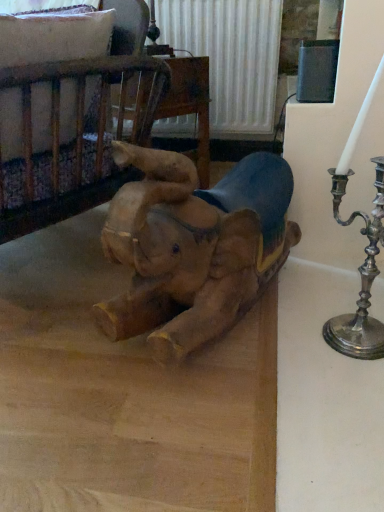
Where is `free space to the right of wooden elephant at center`? This screenshot has width=384, height=512. free space to the right of wooden elephant at center is located at coordinates (298, 300).